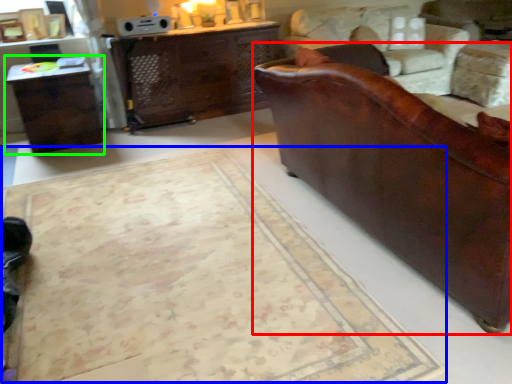
Question: Which object is positioned closest to studio couch (highlighted by a red box)? Select from mat (highlighted by a blue box) and table (highlighted by a green box).

Choices:
 (A) mat
 (B) table

Answer: (A)